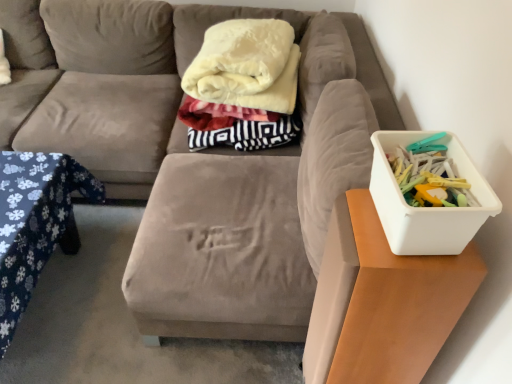
Question: Considering their positions, is velvet beige couch at center located in front of or behind white plastic container at right, which is counted as the first table, starting from the right?

Choices:
 (A) behind
 (B) front

Answer: (A)

Question: Considering the positions of point (159, 163) and point (366, 296), is point (159, 163) closer or farther from the camera than point (366, 296)?

Choices:
 (A) closer
 (B) farther

Answer: (B)

Question: Which is nearer to the white plastic container at right?

Choices:
 (A) white plastic container at right, which is counted as the first table, starting from the right
 (B) soft cream fleece blanket at center
 (C) velvet beige couch at center
 (D) blue fabric table at lower left, marked as the 1th table in a left-to-right arrangement

Answer: (A)

Question: Which of these objects is positioned farthest from the white plastic container at right?

Choices:
 (A) velvet beige couch at center
 (B) blue fabric table at lower left, the 2th table viewed from the right
 (C) white plastic container at right, which is counted as the first table, starting from the right
 (D) soft cream fleece blanket at center

Answer: (B)